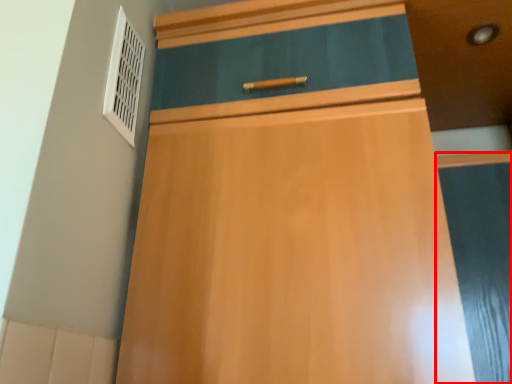
Question: From the image's perspective, where is screen door (annotated by the red box) located relative to air conditioning?

Choices:
 (A) below
 (B) above

Answer: (A)